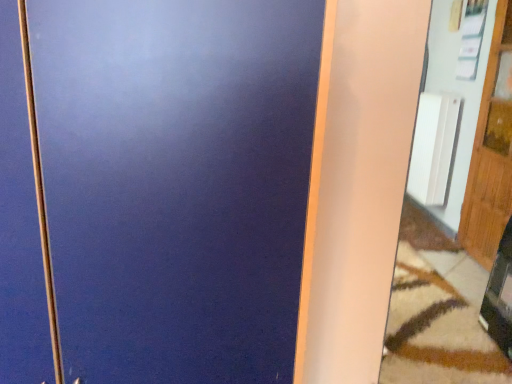
The image size is (512, 384). I want to click on white ribbed radiator at right, so click(x=433, y=147).

From the picture: Is matte white mirror at right not inside white ribbed radiator at right?

That's correct, matte white mirror at right is outside of white ribbed radiator at right.

Based on the photo, considering the sizes of objects matte white mirror at right and white ribbed radiator at right in the image provided, who is bigger, matte white mirror at right or white ribbed radiator at right?

With larger size is matte white mirror at right.

From the image's perspective, is matte white mirror at right on top of white ribbed radiator at right?

No.

Is matte white mirror at right positioned behind wooden door at right?

No, it is in front of wooden door at right.

Considering the positions of points (436, 170) and (509, 105), is point (436, 170) closer to camera compared to point (509, 105)?

No, (436, 170) is behind (509, 105).

Considering the relative positions of matte white mirror at right and wooden door at right in the image provided, is matte white mirror at right to the left or to the right of wooden door at right?

Based on their positions, matte white mirror at right is located to the left of wooden door at right.

How different are the orientations of matte white mirror at right and wooden door at right in degrees?

The angle between the facing direction of matte white mirror at right and the facing direction of wooden door at right is 90.6 degrees.

Considering the sizes of objects white ribbed radiator at right and matte white mirror at right in the image provided, who is thinner, white ribbed radiator at right or matte white mirror at right?

Thinner between the two is white ribbed radiator at right.

Is white ribbed radiator at right directly adjacent to matte white mirror at right?

There is a gap between white ribbed radiator at right and matte white mirror at right.

Between white ribbed radiator at right and matte white mirror at right, which one is positioned in front?

matte white mirror at right is more forward.

Between white ribbed radiator at right and matte white mirror at right, which one has smaller size?

white ribbed radiator at right.

Where is `door below the white ribbed radiator at right (from the image's perspective)`? This screenshot has height=384, width=512. door below the white ribbed radiator at right (from the image's perspective) is located at coordinates (490, 156).

Is wooden door at right not near white ribbed radiator at right?

That's not correct — wooden door at right is a little close to white ribbed radiator at right.

Looking at this image, is wooden door at right in front of white ribbed radiator at right?

That is True.

Considering the positions of objects white ribbed radiator at right and wooden door at right in the image provided, who is more to the left, white ribbed radiator at right or wooden door at right?

From the viewer's perspective, white ribbed radiator at right appears more on the left side.

Is wooden door at right at the back of white ribbed radiator at right?

No, white ribbed radiator at right's orientation is not away from wooden door at right.

Does white ribbed radiator at right lie in front of wooden door at right?

No, it is not.

How many degrees apart are the facing directions of white ribbed radiator at right and wooden door at right?

They differ by 2.1 degrees in their facing directions.

Can you tell me how much wooden door at right and matte white mirror at right differ in facing direction?

The facing directions of wooden door at right and matte white mirror at right are 90.6 degrees apart.

Which object is closer to the camera taking this photo, wooden door at right or matte white mirror at right?

matte white mirror at right is more forward.

Does wooden door at right appear on the right side of matte white mirror at right?

Correct, you'll find wooden door at right to the right of matte white mirror at right.

Where is `mirror below the wooden door at right (from a real-world perspective)`? The image size is (512, 384). mirror below the wooden door at right (from a real-world perspective) is located at coordinates (453, 214).

At what (x,y) coordinates should I click in order to perform the action: click on mirror that is below the white ribbed radiator at right (from the image's perspective). Please return your answer as a coordinate pair (x, y). This screenshot has height=384, width=512. Looking at the image, I should click on pos(453,214).

I want to click on mirror below the wooden door at right (from a real-world perspective), so click(x=453, y=214).

Looking at the image, which one is located closer to white ribbed radiator at right, wooden door at right or matte white mirror at right?

matte white mirror at right.

Based on their spatial positions, is matte white mirror at right or white ribbed radiator at right closer to wooden door at right?

The object closer to wooden door at right is matte white mirror at right.

Which object lies further to the anchor point matte white mirror at right, white ribbed radiator at right or wooden door at right?

white ribbed radiator at right.

From the image, which object appears to be farther from white ribbed radiator at right, matte white mirror at right or wooden door at right?

wooden door at right lies further to white ribbed radiator at right than the other object.

When comparing their distances from wooden door at right, does white ribbed radiator at right or matte white mirror at right seem further?

white ribbed radiator at right.

Which object lies further to the anchor point matte white mirror at right, wooden door at right or white ribbed radiator at right?

white ribbed radiator at right is positioned further to the anchor matte white mirror at right.

At what (x,y) coordinates should I click in order to perform the action: click on door between matte white mirror at right and white ribbed radiator at right in the front-back direction. Please return your answer as a coordinate pair (x, y). Image resolution: width=512 pixels, height=384 pixels. Looking at the image, I should click on (490, 156).